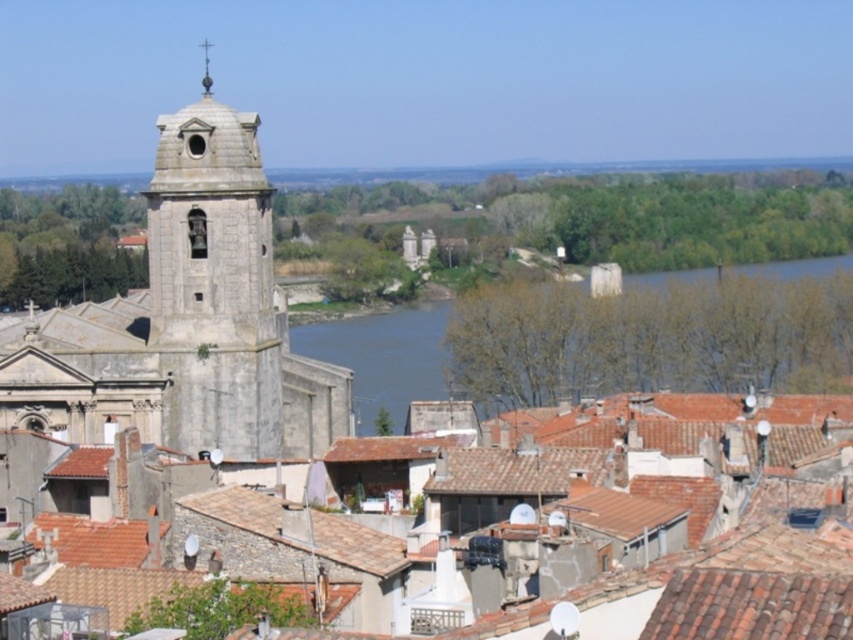
Question: Considering the relative positions of green water at center and smooth gray stone spire at upper center in the image provided, where is green water at center located with respect to smooth gray stone spire at upper center?

Choices:
 (A) left
 (B) right

Answer: (B)

Question: Which of these objects is positioned closest to the smooth gray stone spire at upper center?

Choices:
 (A) gray stone church at left
 (B) stone bell tower at left

Answer: (B)

Question: Can you confirm if stone bell tower at left is bigger than green water at center?

Choices:
 (A) yes
 (B) no

Answer: (B)

Question: Which of the following is the farthest from the observer?

Choices:
 (A) (374, 404)
 (B) (229, 422)

Answer: (A)

Question: Does green water at center appear under smooth gray stone spire at upper center?

Choices:
 (A) yes
 (B) no

Answer: (A)

Question: Which object appears farthest from the camera in this image?

Choices:
 (A) green water at center
 (B) stone bell tower at left
 (C) gray stone church at left
 (D) smooth gray stone spire at upper center

Answer: (A)